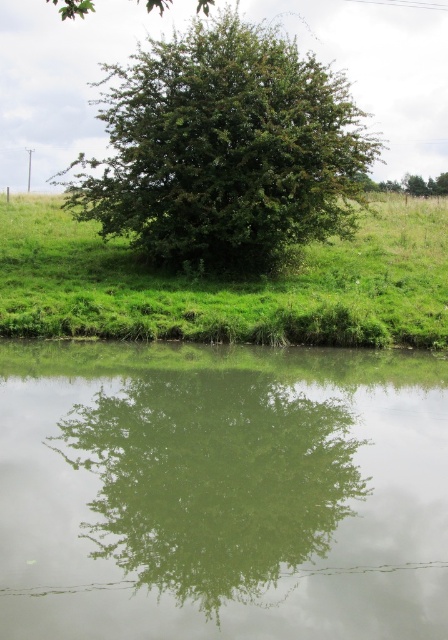
Question: Is green leafy tree at center smaller than green grassy at center?

Choices:
 (A) yes
 (B) no

Answer: (B)

Question: Can you confirm if green reflective water at center is bigger than green grassy at center?

Choices:
 (A) yes
 (B) no

Answer: (B)

Question: Estimate the real-world distances between objects in this image. Which object is closer to the green reflective water at center?

Choices:
 (A) green leafy tree at center
 (B) green grassy at center

Answer: (B)

Question: Can you confirm if green reflective water at center is bigger than green leafy tree at center?

Choices:
 (A) no
 (B) yes

Answer: (A)

Question: Which point is farther to the camera?

Choices:
 (A) (77, 540)
 (B) (219, 83)

Answer: (B)

Question: Which point is closer to the camera?

Choices:
 (A) green reflective water at center
 (B) green grassy at center

Answer: (A)